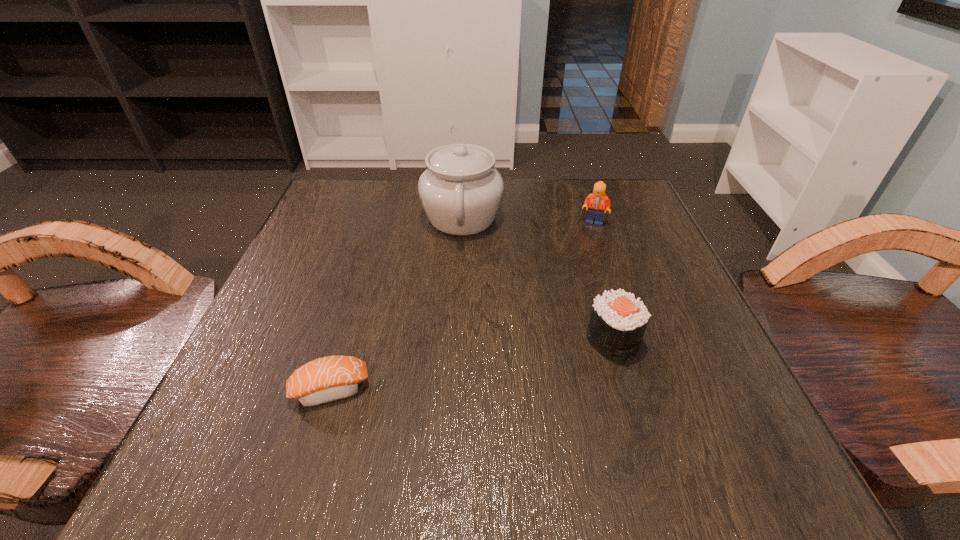
In the image, there is a desktop. At what (x,y) coordinates should I click in order to perform the action: click on blank space at the right edge. Please return your answer as a coordinate pair (x, y). Looking at the image, I should click on (656, 271).

In the image, there is a desktop. Identify the location of vacant space at the far left corner. coord(316,205).

The image size is (960, 540). What are the coordinates of `vacant space at the near left corner of the desktop` in the screenshot? It's located at (297, 435).

This screenshot has width=960, height=540. What are the coordinates of `vacant region at the far right corner of the desktop` in the screenshot? It's located at (597, 180).

Find the location of a particular element. unoccupied area between the left sushi and the second tallest object is located at coordinates (462, 306).

What are the coordinates of `empty space between the second tallest object and the second shortest object` in the screenshot? It's located at (603, 281).

At what (x,y) coordinates should I click in order to perform the action: click on blank region between the chinaware and the taller sushi. Please return your answer as a coordinate pair (x, y). This screenshot has height=540, width=960. Looking at the image, I should click on (538, 279).

Image resolution: width=960 pixels, height=540 pixels. In order to click on vacant point located between the third object from right to left and the nearer sushi in this screenshot , I will do `click(396, 303)`.

Where is `unoccupied position between the second shortest object and the Lego`? unoccupied position between the second shortest object and the Lego is located at coordinates 603,281.

Locate an element on the screen. This screenshot has height=540, width=960. vacant region between the third shortest object and the tallest object is located at coordinates (528, 220).